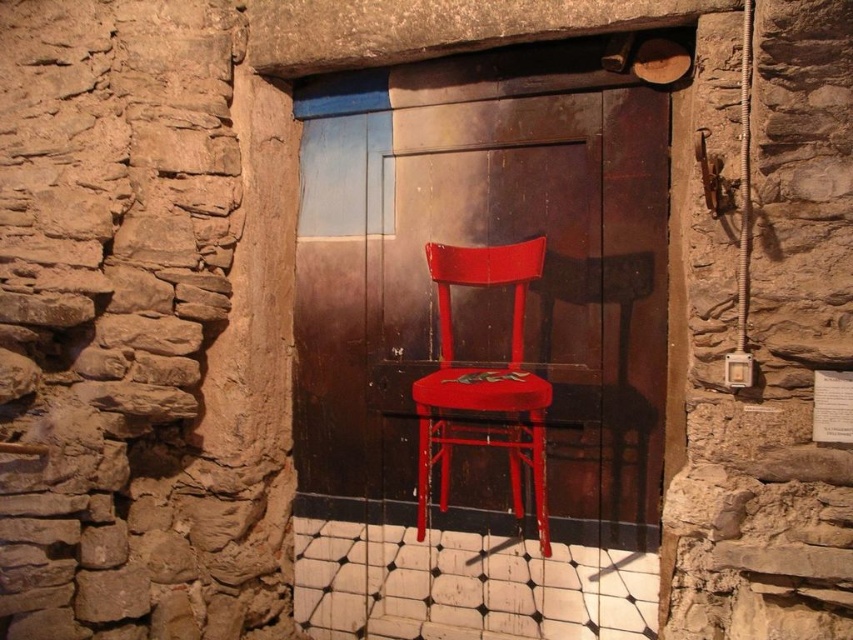
Question: Is matte wood door at center above matte red chair at center?

Choices:
 (A) no
 (B) yes

Answer: (B)

Question: Does matte wood door at center appear on the right side of matte red chair at center?

Choices:
 (A) no
 (B) yes

Answer: (A)

Question: Which object is farther from the camera taking this photo?

Choices:
 (A) matte wood door at center
 (B) matte red chair at center

Answer: (B)

Question: Which point is closer to the camera taking this photo?

Choices:
 (A) (445, 452)
 (B) (548, 490)

Answer: (B)

Question: Can you confirm if matte wood door at center is positioned to the left of matte red chair at center?

Choices:
 (A) no
 (B) yes

Answer: (B)